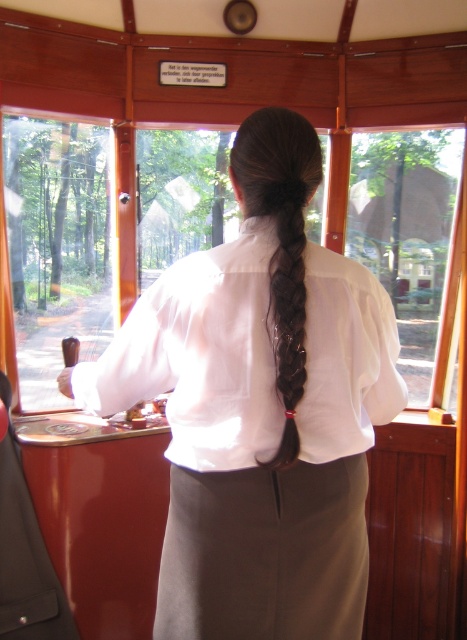
You are a passenger in the vintage tram and want to move from the point at coordinates point (162, 321) to the point at coordinates point (278, 337). Can you walk directly towards the destination without needing to go around any obstacles?

Point (162, 321) is behind point (278, 337), so you cannot walk directly to the destination without going around the obstacle.

In the scene shown: You are a passenger in the vintage tram and want to know which of the two points, point (x=239, y=364) or point (x=281, y=392), is closer to you. Based on the scene, can you determine this?

Point (x=239, y=364) is closer to you because it is further to the camera than point (x=281, y=392). Wait, that seems contradictory. Let me check the description again. The description says point (x=239, y=364) is further to the camera than point (x=281, y=392). Therefore, point (x=281, y=392) is closer to you.

You are a passenger sitting in the vintage tram and want to look outside through the transparent glass window at left. However, you notice the brown silky hair braid at center back is blocking your view. Which object is closer to you, the window or the braid?

The transparent glass window at left is closer to you than the brown silky hair braid at center back, so the braid is blocking the window because it is further away.